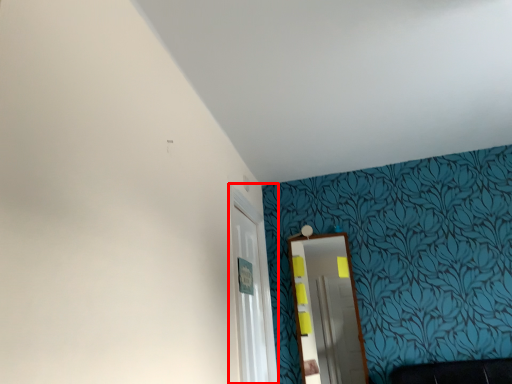
Question: From the image's perspective, what is the correct spatial relationship of glass door (annotated by the red box) in relation to mirror?

Choices:
 (A) above
 (B) below

Answer: (A)